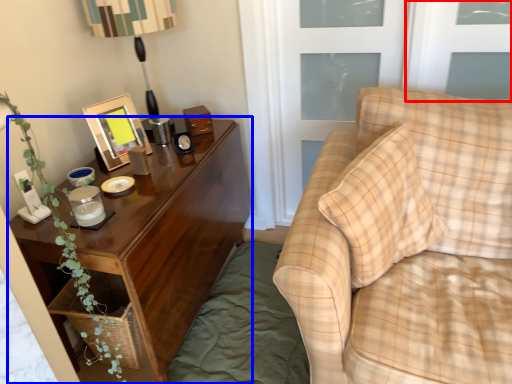
Question: Which of the following is the closest to the observer, window (highlighted by a red box) or nightstand (highlighted by a blue box)?

Choices:
 (A) window
 (B) nightstand

Answer: (B)